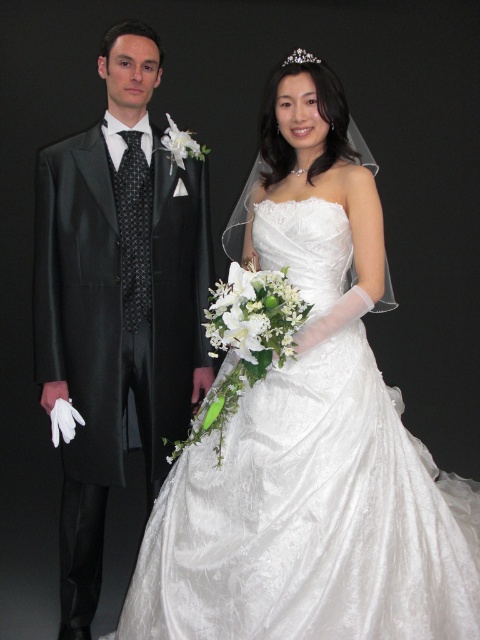
Where is the matte black suit at left located in the image?

The matte black suit at left is located at point 0.472 on the x axis and 0.244 on the y axis.

You are a photographer standing at the point marked by the coordinate point at point (208, 609). You want to capture a photo of both the person on the left and the bride on the right in the same frame. Given that your camera has a maximum focal length that allows capturing subjects up to 2 meters apart, will you be able to include both in the photo?

The distance between the person on the left and the bride on the right is 1.86 meters, which is within the camera maximum focal length of 2 meters. Therefore, you can include both in the photo.

You are a photographer positioned at the origin point. You need to determine the direction to focus your camera to capture the white satin dress at center. Based on its coordinates, is it to the left or right of your current position?

The white satin dress at center is located at point 0.812 on the x and 0.646 on the y. Since the x coordinate is greater than 0.5, it is to the right of the photographer.